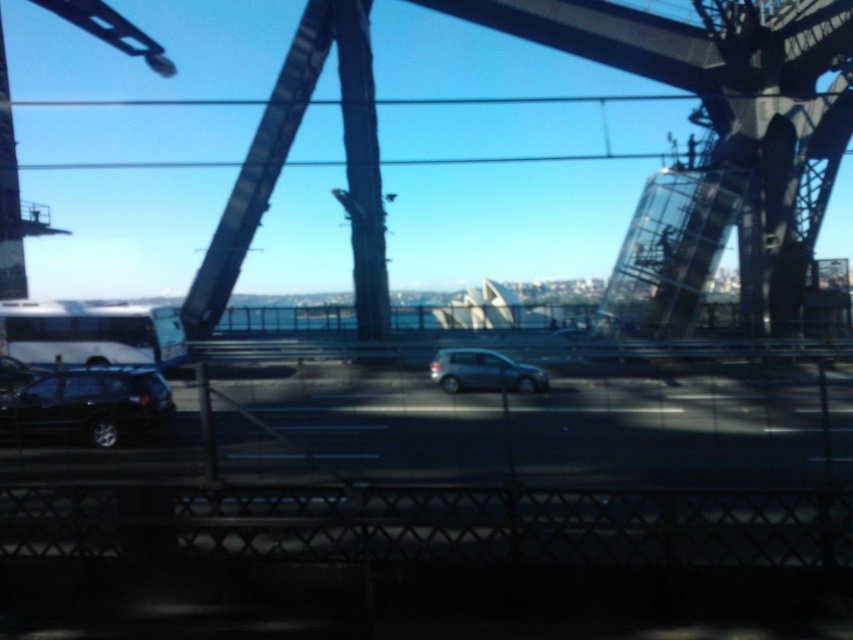
Question: Is shiny black suv at lower left in front of satin silver car at center?

Choices:
 (A) no
 (B) yes

Answer: (B)

Question: Can you confirm if shiny black suv at lower left is smaller than shiny black sedan at lower left?

Choices:
 (A) no
 (B) yes

Answer: (B)

Question: Which point appears closest to the camera in this image?

Choices:
 (A) (450, 392)
 (B) (352, 10)

Answer: (A)

Question: Which object is the closest to the satin silver car at center?

Choices:
 (A) black metal bridge at center
 (B) shiny black suv at lower left
 (C) shiny black sedan at lower left

Answer: (A)

Question: Estimate the real-world distances between objects in this image. Which object is farther from the black metal bridge at center?

Choices:
 (A) satin silver car at center
 (B) shiny black sedan at lower left
 (C) shiny black suv at lower left

Answer: (C)

Question: Is satin silver car at center thinner than shiny black sedan at lower left?

Choices:
 (A) no
 (B) yes

Answer: (B)